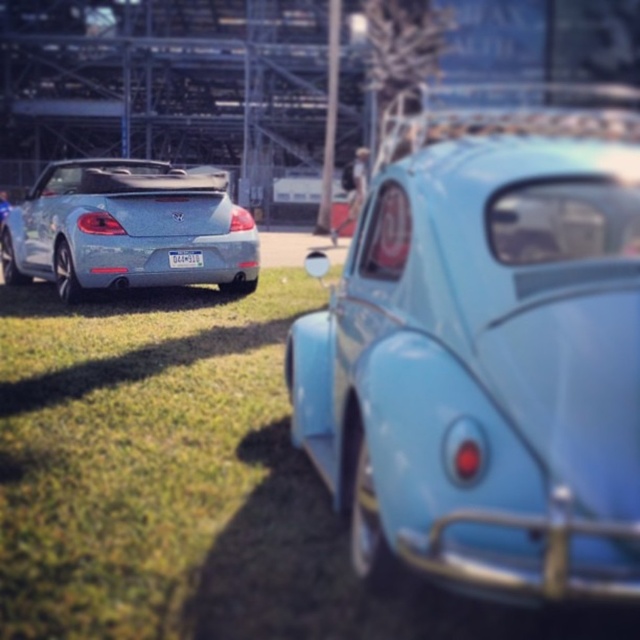
Question: Which point is farther to the camera?

Choices:
 (A) (198, 253)
 (B) (81, 188)
 (C) (531, 497)

Answer: (B)

Question: Can you confirm if light blue matte car at center is positioned below satin silver convertible at left?

Choices:
 (A) no
 (B) yes

Answer: (B)

Question: Does light blue matte car at center appear on the right side of satin silver convertible at left?

Choices:
 (A) no
 (B) yes

Answer: (B)

Question: Does satin silver convertible at left have a lesser width compared to white plastic license plate at rear?

Choices:
 (A) yes
 (B) no

Answer: (A)

Question: Which point is closer to the camera?

Choices:
 (A) (563, 180)
 (B) (144, 272)

Answer: (A)

Question: Which object appears closest to the camera in this image?

Choices:
 (A) light blue matte car at center
 (B) satin silver convertible at left

Answer: (A)